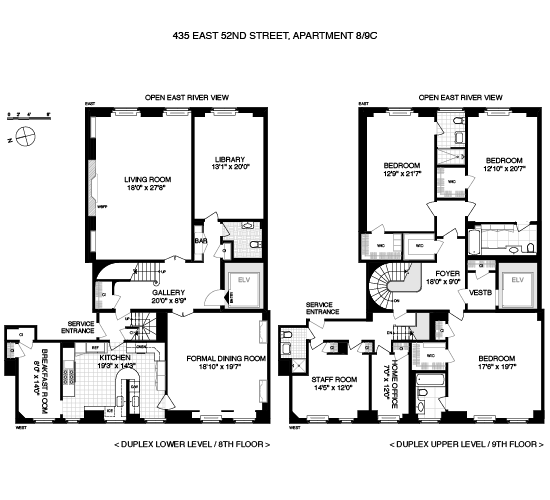
The width and height of the screenshot is (550, 500). Find the location of `duplex upper level / 9th floor plan`. duplex upper level / 9th floor plan is located at coordinates (459, 290).